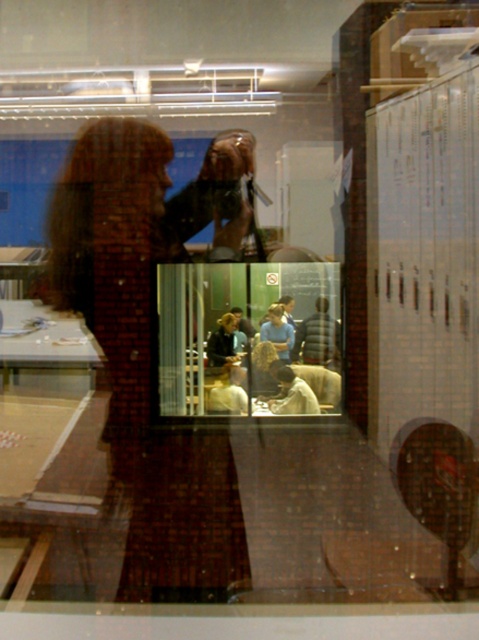
You are trying to exit through the transparent glass door at center while wearing the dark gray jacket at center. Will the jacket fit through the door without needing to remove it?

The transparent glass door at center might be wider than dark gray jacket at center, so the jacket should fit through the door without needing to remove it.